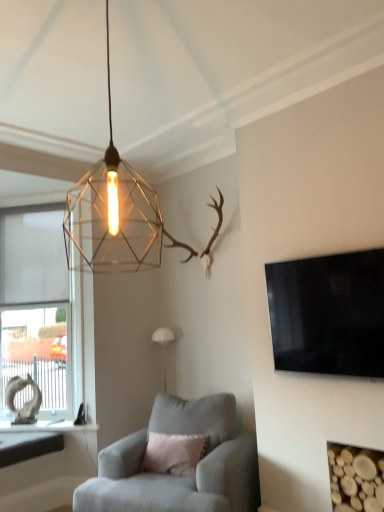
Question: From a real-world perspective, is black glossy flat-screen tv at right below metallic wireframe pendant light at upper center, the 1th lamp viewed from the top?

Choices:
 (A) yes
 (B) no

Answer: (A)

Question: From the image's perspective, would you say black glossy flat-screen tv at right is shown under metallic wireframe pendant light at upper center, the 1th lamp viewed from the top?

Choices:
 (A) yes
 (B) no

Answer: (A)

Question: Can you confirm if black glossy flat-screen tv at right is taller than metallic wireframe pendant light at upper center, positioned as the 2th lamp in bottom-to-top order?

Choices:
 (A) yes
 (B) no

Answer: (B)

Question: Are black glossy flat-screen tv at right and metallic wireframe pendant light at upper center, positioned as the 2th lamp in bottom-to-top order, far apart?

Choices:
 (A) yes
 (B) no

Answer: (A)

Question: Can you confirm if black glossy flat-screen tv at right is wider than metallic wireframe pendant light at upper center, the 1th lamp viewed from the top?

Choices:
 (A) no
 (B) yes

Answer: (A)

Question: From a real-world perspective, is wooden logs at lower right positioned above or below black glossy flat-screen tv at right?

Choices:
 (A) above
 (B) below

Answer: (B)

Question: Is point (350, 508) positioned closer to the camera than point (354, 360)?

Choices:
 (A) farther
 (B) closer

Answer: (A)

Question: In terms of width, does wooden logs at lower right look wider or thinner when compared to black glossy flat-screen tv at right?

Choices:
 (A) thin
 (B) wide

Answer: (B)

Question: From the image's perspective, is wooden logs at lower right located above or below black glossy flat-screen tv at right?

Choices:
 (A) below
 (B) above

Answer: (A)

Question: Looking at their shapes, would you say white matte window at left is wider or thinner than black glossy flat-screen tv at right?

Choices:
 (A) thin
 (B) wide

Answer: (B)

Question: Is white matte window at left in front of or behind black glossy flat-screen tv at right in the image?

Choices:
 (A) front
 (B) behind

Answer: (B)

Question: From a real-world perspective, is white matte window at left positioned above or below black glossy flat-screen tv at right?

Choices:
 (A) below
 (B) above

Answer: (B)

Question: Is point (79, 287) closer or farther from the camera than point (375, 298)?

Choices:
 (A) farther
 (B) closer

Answer: (A)

Question: Looking at the image, does white matte window at left seem bigger or smaller compared to metallic wireframe pendant light at upper center, acting as the 2th lamp starting from the back?

Choices:
 (A) big
 (B) small

Answer: (A)

Question: In the image, is white matte window at left positioned in front of or behind metallic wireframe pendant light at upper center, the 1th lamp viewed from the top?

Choices:
 (A) front
 (B) behind

Answer: (B)